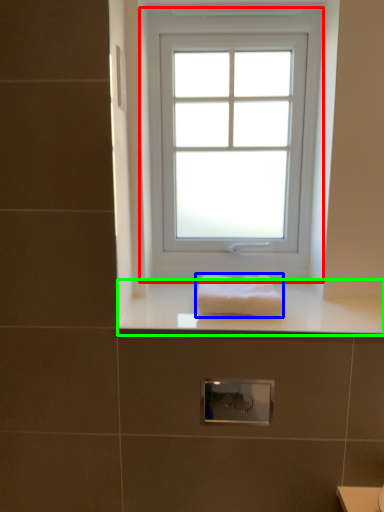
Question: Based on their relative distances, which object is farther from window (highlighted by a red box)? Choose from towel (highlighted by a blue box) and counter top (highlighted by a green box).

Choices:
 (A) towel
 (B) counter top

Answer: (A)